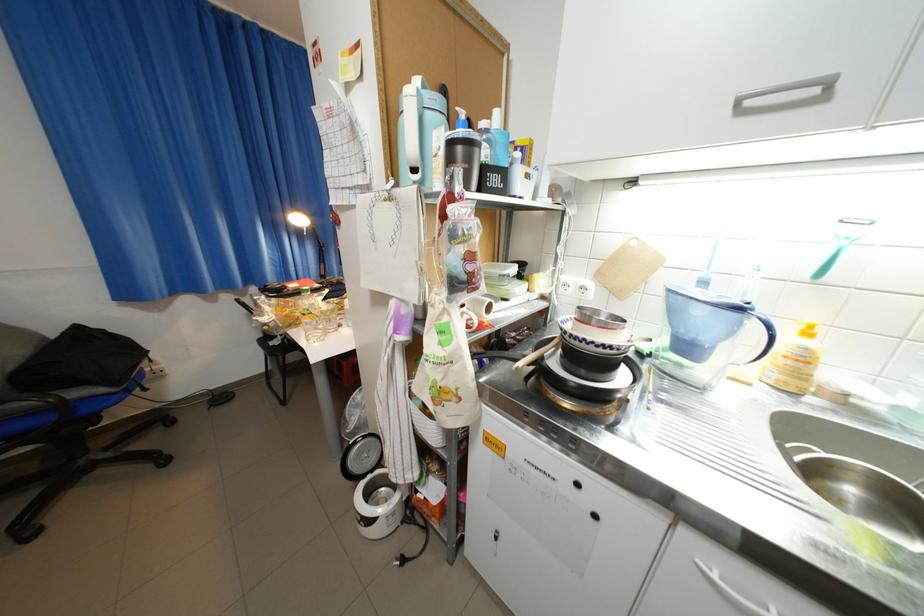
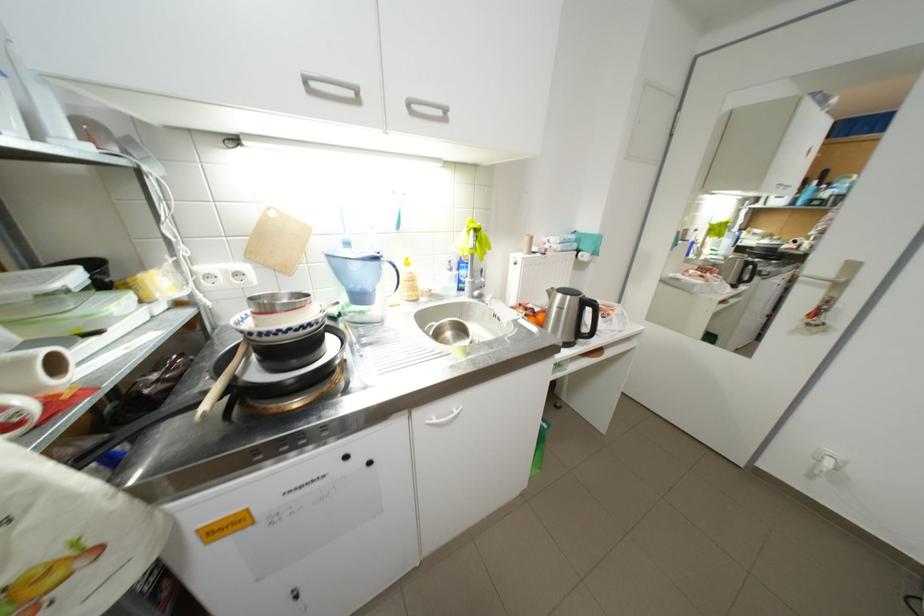
Locate, in the second image, the point that corresponds to point 501,301 in the first image.

(54, 352)